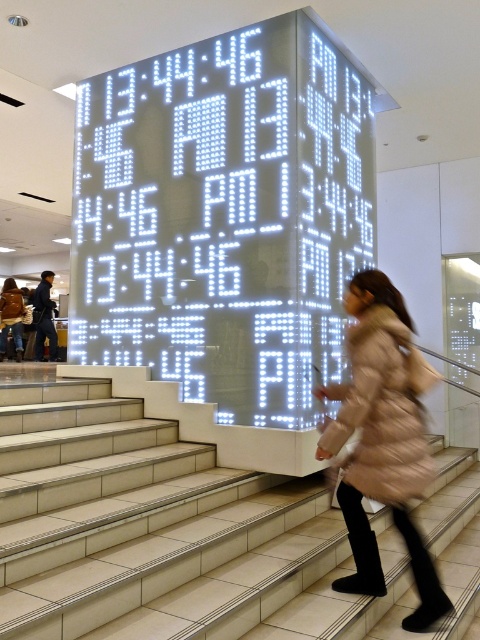
Question: Can you confirm if white tile stairs at center is thinner than dark blue jeans at left?

Choices:
 (A) no
 (B) yes

Answer: (A)

Question: Among these objects, which one is nearest to the camera?

Choices:
 (A) beige fur coat at right
 (B) dark blue jeans at left

Answer: (A)

Question: Which of the following is the closest to the observer?

Choices:
 (A) dark blue jeans at left
 (B) beige fur coat at right
 (C) white tile stairs at center

Answer: (C)

Question: Does white tile stairs at center appear under light brown fur coat at lower left?

Choices:
 (A) no
 (B) yes

Answer: (B)

Question: Is white tile stairs at center closer to the viewer compared to light brown fur coat at lower left?

Choices:
 (A) yes
 (B) no

Answer: (A)

Question: Which point is closer to the camera taking this photo?

Choices:
 (A) (13, 342)
 (B) (32, 300)
 (C) (288, 592)

Answer: (C)